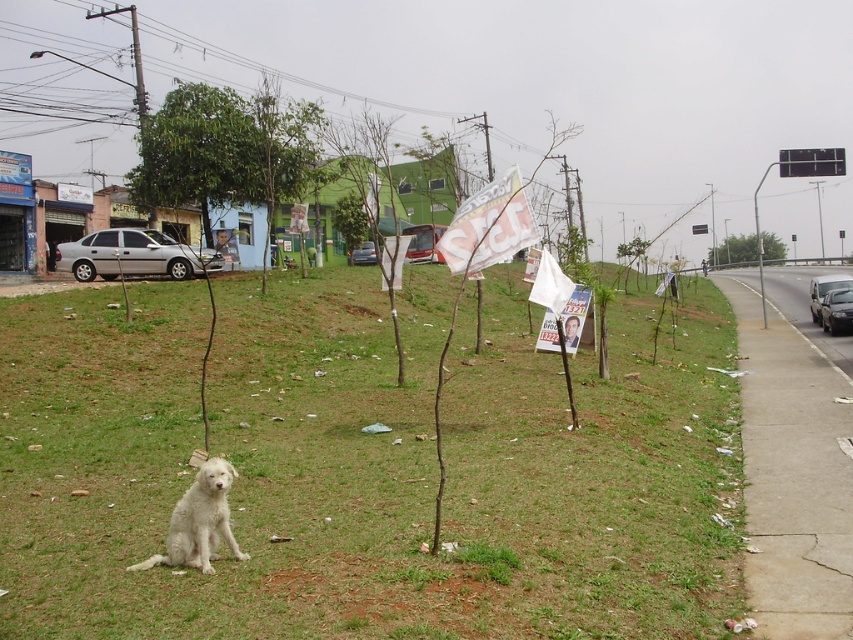
Question: In this image, where is green grassy at lower left located relative to white fluffy dog at lower left?

Choices:
 (A) left
 (B) right

Answer: (B)

Question: Which of the following is the farthest from the observer?

Choices:
 (A) (198, 468)
 (B) (323, 481)

Answer: (A)

Question: In this image, where is green grassy at lower left located relative to white fluffy dog at lower left?

Choices:
 (A) left
 (B) right

Answer: (B)

Question: Is green grassy at lower left to the left of white fluffy dog at lower left from the viewer's perspective?

Choices:
 (A) yes
 (B) no

Answer: (B)

Question: Which point is farther to the camera?

Choices:
 (A) (216, 532)
 (B) (572, 493)

Answer: (B)